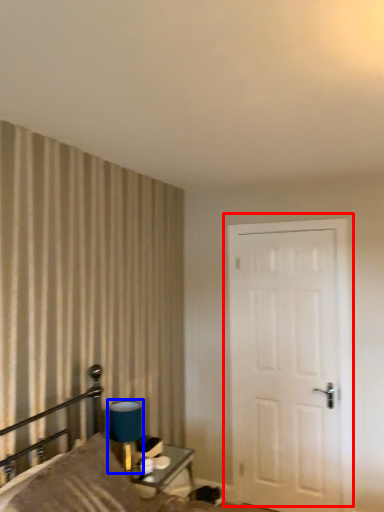
Question: Which of the following is the closest to the observer, door (highlighted by a red box) or table lamp (highlighted by a blue box)?

Choices:
 (A) door
 (B) table lamp

Answer: (B)